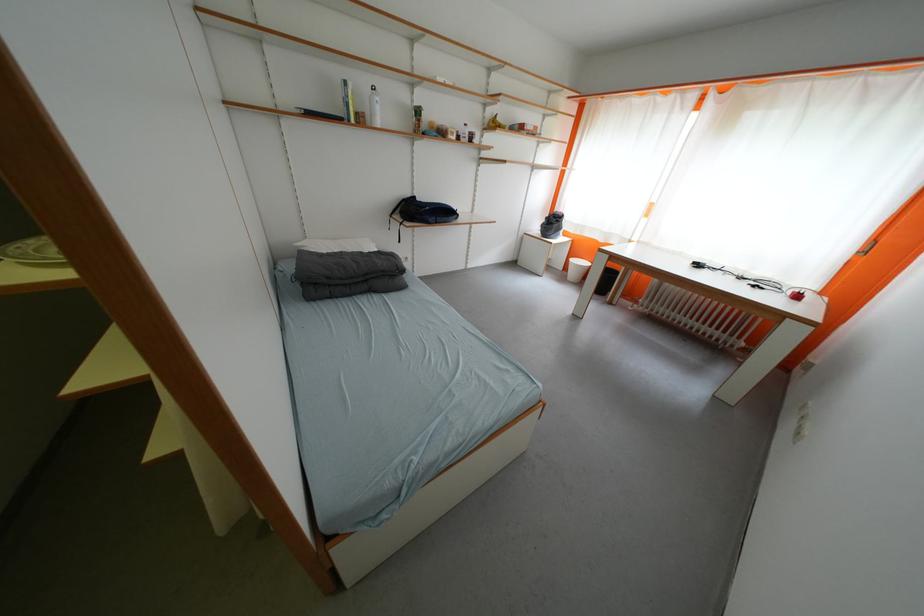
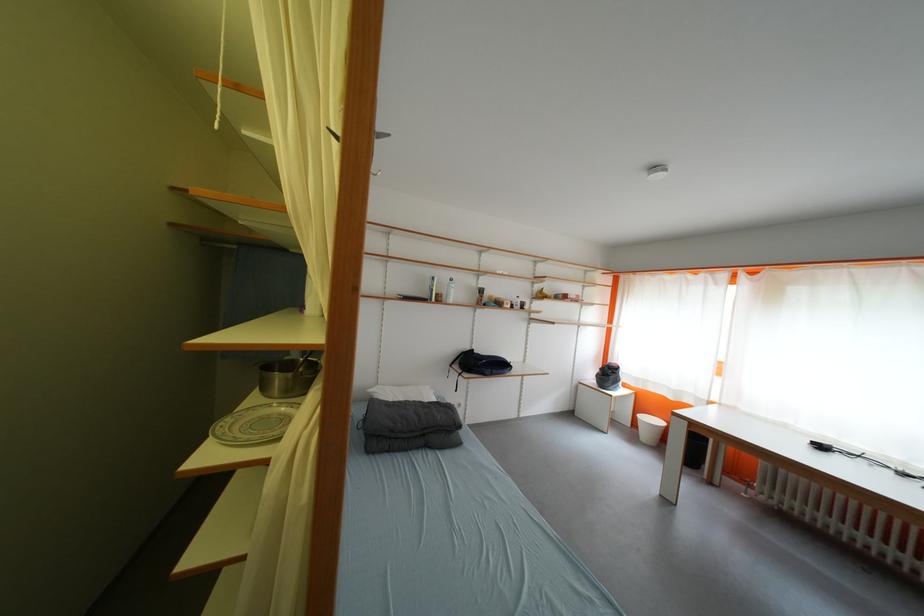
Where in the second image is the point corresponding to [308,246] from the first image?

(380, 392)